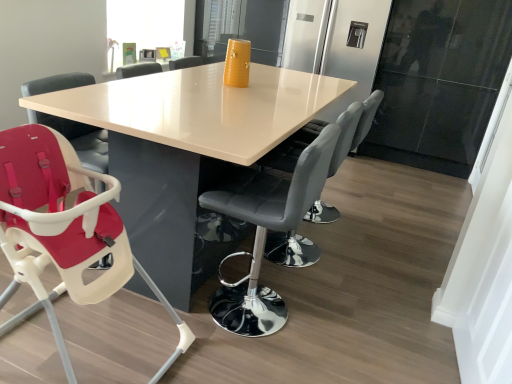
This screenshot has width=512, height=384. I want to click on free space in front of matte black chair at center, placed as the third chair when sorted from left to right, so click(320, 289).